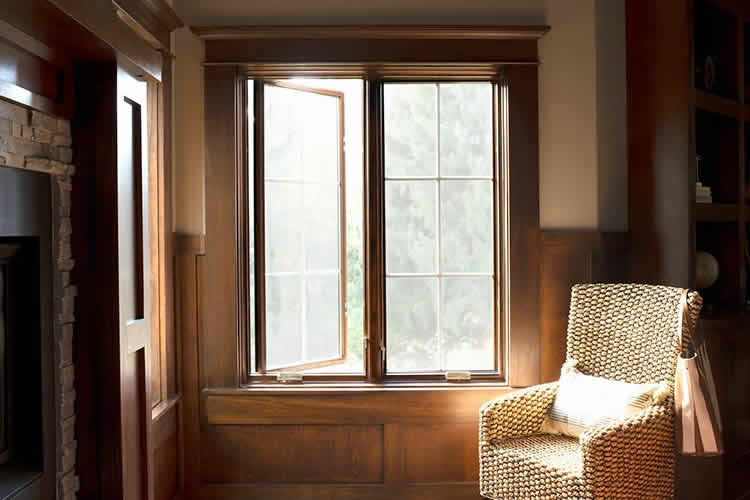
The width and height of the screenshot is (750, 500). In order to click on windows in this screenshot , I will do `click(442, 324)`.